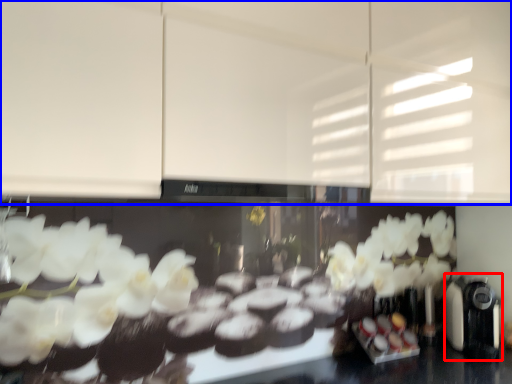
Question: Which of the following is the farthest to the observer, coffee machine (highlighted by a red box) or cabinetry (highlighted by a blue box)?

Choices:
 (A) coffee machine
 (B) cabinetry

Answer: (A)